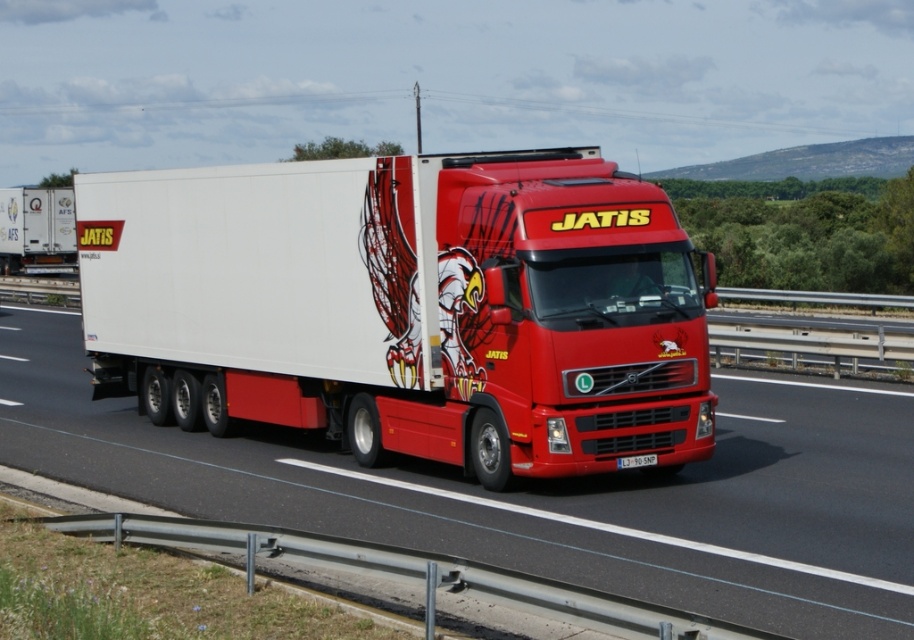
Can you confirm if matte white trailer at center is positioned above white glossy trailer at center?

Indeed, matte white trailer at center is positioned over white glossy trailer at center.

Is matte white trailer at center bigger than white glossy trailer at center?

Indeed, matte white trailer at center has a larger size compared to white glossy trailer at center.

Which is in front, point (90, 173) or point (837, 573)?

Point (837, 573)

Find the location of a particular element. This screenshot has height=640, width=914. matte white trailer at center is located at coordinates (405, 307).

Does white glossy trailer at center appear under white matte trailer at left?

Correct, white glossy trailer at center is located below white matte trailer at left.

Who is higher up, white glossy trailer at center or white matte trailer at left?

white matte trailer at left is higher up.

The width and height of the screenshot is (914, 640). I want to click on white glossy trailer at center, so click(537, 492).

Is matte white trailer at center to the right of white plastic license plate at center from the viewer's perspective?

No, matte white trailer at center is not to the right of white plastic license plate at center.

Can you confirm if matte white trailer at center is smaller than white plastic license plate at center?

No.

The width and height of the screenshot is (914, 640). I want to click on matte white trailer at center, so click(x=405, y=307).